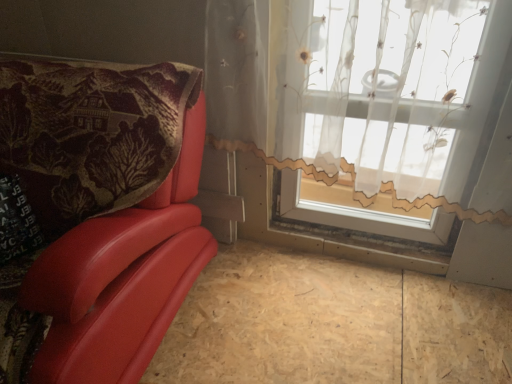
This screenshot has width=512, height=384. Identify the location of translucent floral-patterned curtain at upper right. (366, 94).

What do you see at coordinates (366, 94) in the screenshot? I see `translucent floral-patterned curtain at upper right` at bounding box center [366, 94].

This screenshot has width=512, height=384. I want to click on plywood at lower left, so click(x=331, y=324).

Locate an element on the screen. translucent floral-patterned curtain at upper right is located at coordinates (366, 94).

Is translucent floral-patterned curtain at upper right surrounded by matte red leather chair at left?

Definitely not — translucent floral-patterned curtain at upper right is not inside matte red leather chair at left.

How different are the orientations of matte red leather chair at left and translucent floral-patterned curtain at upper right in degrees?

→ 0.787 degrees.

Is matte red leather chair at left far away from translucent floral-patterned curtain at upper right?

No, there isn't a large distance between matte red leather chair at left and translucent floral-patterned curtain at upper right.

Considering the sizes of objects matte red leather chair at left and translucent floral-patterned curtain at upper right in the image provided, who is taller, matte red leather chair at left or translucent floral-patterned curtain at upper right?

translucent floral-patterned curtain at upper right.

Is plywood at lower left oriented away from matte red leather chair at left?

That's not correct — plywood at lower left is not looking away from matte red leather chair at left.

Considering the sizes of plywood at lower left and matte red leather chair at left in the image, is plywood at lower left taller or shorter than matte red leather chair at left?

plywood at lower left is shorter than matte red leather chair at left.

Is translucent floral-patterned curtain at upper right behind matte red leather chair at left?

Yes, the depth of translucent floral-patterned curtain at upper right is greater than that of matte red leather chair at left.

Is translucent floral-patterned curtain at upper right looking in the opposite direction of matte red leather chair at left?

translucent floral-patterned curtain at upper right is not turned away from matte red leather chair at left.

Choose the correct answer: Is translucent floral-patterned curtain at upper right inside matte red leather chair at left or outside it?

translucent floral-patterned curtain at upper right is spatially situated outside matte red leather chair at left.

Considering the sizes of objects matte red leather chair at left and plywood at lower left in the image provided, who is smaller, matte red leather chair at left or plywood at lower left?

With smaller size is plywood at lower left.

How many degrees apart are the facing directions of matte red leather chair at left and plywood at lower left?

matte red leather chair at left and plywood at lower left are facing 2.34 degrees away from each other.

From a real-world perspective, relative to plywood at lower left, is matte red leather chair at left vertically above or below?

Clearly, from a real-world perspective, matte red leather chair at left is above plywood at lower left.

Is matte red leather chair at left looking in the opposite direction of plywood at lower left?

No, matte red leather chair at left's orientation is not away from plywood at lower left.

Considering the sizes of objects translucent floral-patterned curtain at upper right and plywood at lower left in the image provided, who is smaller, translucent floral-patterned curtain at upper right or plywood at lower left?

With smaller size is plywood at lower left.

Is translucent floral-patterned curtain at upper right positioned in front of plywood at lower left?

Yes, translucent floral-patterned curtain at upper right is closer to the camera.

From the image's perspective, is translucent floral-patterned curtain at upper right located beneath plywood at lower left?

No, from the image's perspective, translucent floral-patterned curtain at upper right is not below plywood at lower left.

From the image's perspective, who appears lower, plywood at lower left or translucent floral-patterned curtain at upper right?

plywood at lower left.

Find the location of a particular element. This screenshot has height=384, width=512. plywood that is below the translucent floral-patterned curtain at upper right (from the image's perspective) is located at coordinates (331, 324).

Between plywood at lower left and translucent floral-patterned curtain at upper right, which one appears on the right side from the viewer's perspective?

Positioned to the right is translucent floral-patterned curtain at upper right.

You are a GUI agent. You are given a task and a screenshot of the screen. Output one action in this format:
    pyautogui.click(x=<x>, y=<y>)
    Task: Click on the furniture below the translucent floral-patterned curtain at upper right (from the image's perspective)
    This screenshot has height=384, width=512.
    Given the screenshot: What is the action you would take?
    pyautogui.click(x=100, y=213)

The image size is (512, 384). Identify the location of plywood lying on the right of matte red leather chair at left. pyautogui.click(x=331, y=324).

From the image, which object appears to be nearer to plywood at lower left, translucent floral-patterned curtain at upper right or matte red leather chair at left?

matte red leather chair at left.

Looking at the image, which one is located further to plywood at lower left, matte red leather chair at left or translucent floral-patterned curtain at upper right?

translucent floral-patterned curtain at upper right.

Which object lies nearer to the anchor point translucent floral-patterned curtain at upper right, plywood at lower left or matte red leather chair at left?

matte red leather chair at left is positioned closer to the anchor translucent floral-patterned curtain at upper right.

When comparing their distances from matte red leather chair at left, does plywood at lower left or translucent floral-patterned curtain at upper right seem further?

translucent floral-patterned curtain at upper right lies further to matte red leather chair at left than the other object.

Which object lies further to the anchor point translucent floral-patterned curtain at upper right, matte red leather chair at left or plywood at lower left?

Based on the image, plywood at lower left appears to be further to translucent floral-patterned curtain at upper right.

When comparing their distances from matte red leather chair at left, does translucent floral-patterned curtain at upper right or plywood at lower left seem closer?

plywood at lower left is closer to matte red leather chair at left.

Identify the location of plywood between matte red leather chair at left and translucent floral-patterned curtain at upper right from left to right. The width and height of the screenshot is (512, 384). (331, 324).